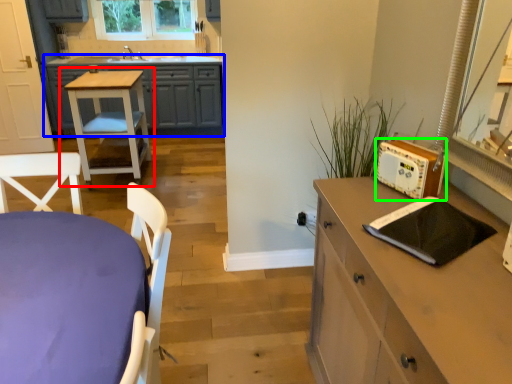
Question: Based on their relative distances, which object is nearer to table (highlighted by a red box)? Choose from cabinetry (highlighted by a blue box) and appliance (highlighted by a green box).

Choices:
 (A) cabinetry
 (B) appliance

Answer: (A)